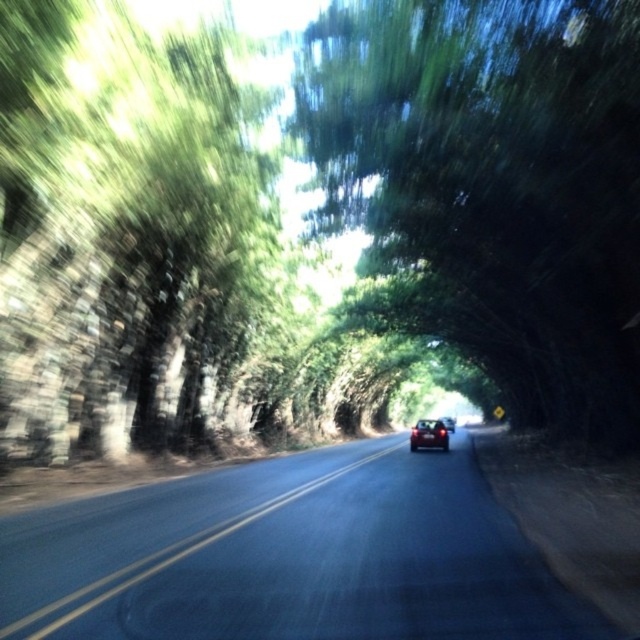
You are driving a car and see the glossy red car at center ahead on the road. There is also a green leafy tree at center. Which object is closer to the left side of the road?

The green leafy tree at center is closer to the left side of the road because it is positioned to the left of the glossy red car at center.

You are driving a glossy red car at center and want to know if you can safely stop before reaching the asphalt road at center. The car can brake at 12 feet per second squared. If you are currently traveling at 30 miles per hour, will you be able to stop in time?

The glossy red car at center is 57.88 feet away from the asphalt road at center. To determine stopping distance, first convert 30 mph to feet per second. 30 mph is approximately 44 feet per second. Using the braking formula, stopping distance is v squared divided by 2 times acceleration. Plugging in the numbers, 44 squared equals 1936. Divided by 2 times 12 gives 1936 divided by 24, which is approximately 80.67 feet. Since 80.67 feet exceeds the 57.88 feet distance, the car cannot stop in time.